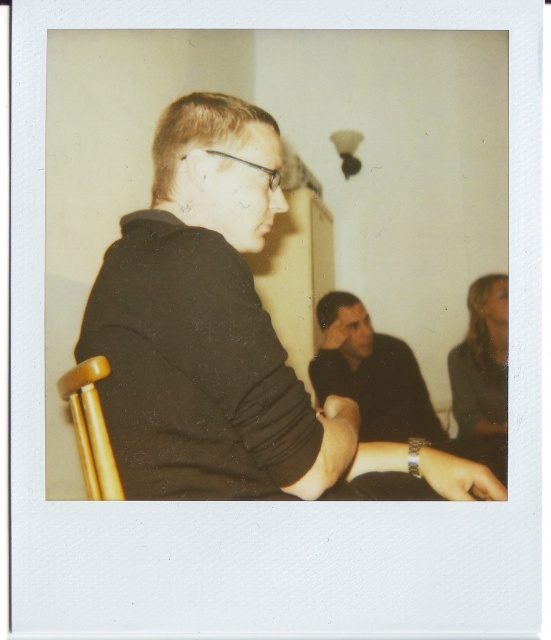
Question: Which object appears closest to the camera in this image?

Choices:
 (A) metallic wristwatch at lower center
 (B) matte black hand at center
 (C) matte black shirt at center
 (D) black matte shirt at center

Answer: (D)

Question: Does metallic wristwatch at lower center have a larger size compared to matte black hand at center?

Choices:
 (A) yes
 (B) no

Answer: (A)

Question: Is matte black shirt at center above matte black hand at center?

Choices:
 (A) yes
 (B) no

Answer: (B)

Question: Among these points, which one is farthest from the camera?

Choices:
 (A) (331, 339)
 (B) (136, 276)

Answer: (A)

Question: Which point is closer to the camera?

Choices:
 (A) (370, 323)
 (B) (278, 138)

Answer: (B)

Question: Does black matte shirt at center have a smaller size compared to matte black shirt at center?

Choices:
 (A) no
 (B) yes

Answer: (B)